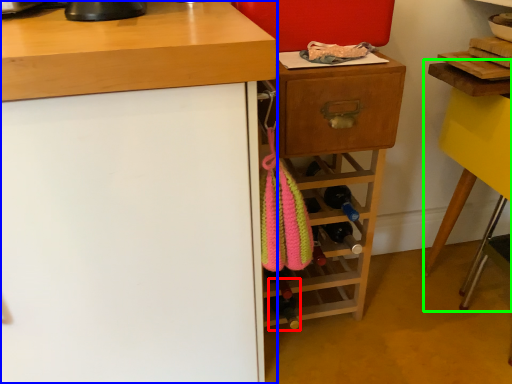
Question: Which object is positioned closest to bottle (highlighted by a red box)? Select from cabinetry (highlighted by a blue box) and computer desk (highlighted by a green box).

Choices:
 (A) cabinetry
 (B) computer desk

Answer: (A)